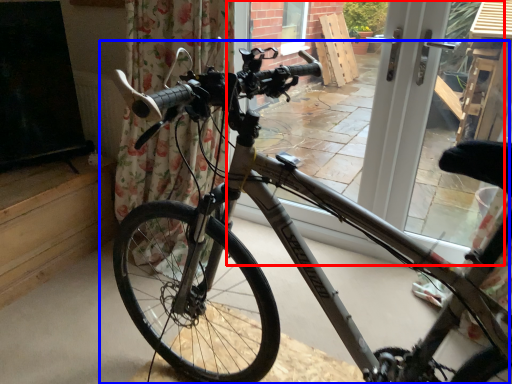
Question: Which of the following is the farthest to the observer, window frame (highlighted by a red box) or bicycle (highlighted by a blue box)?

Choices:
 (A) window frame
 (B) bicycle

Answer: (A)